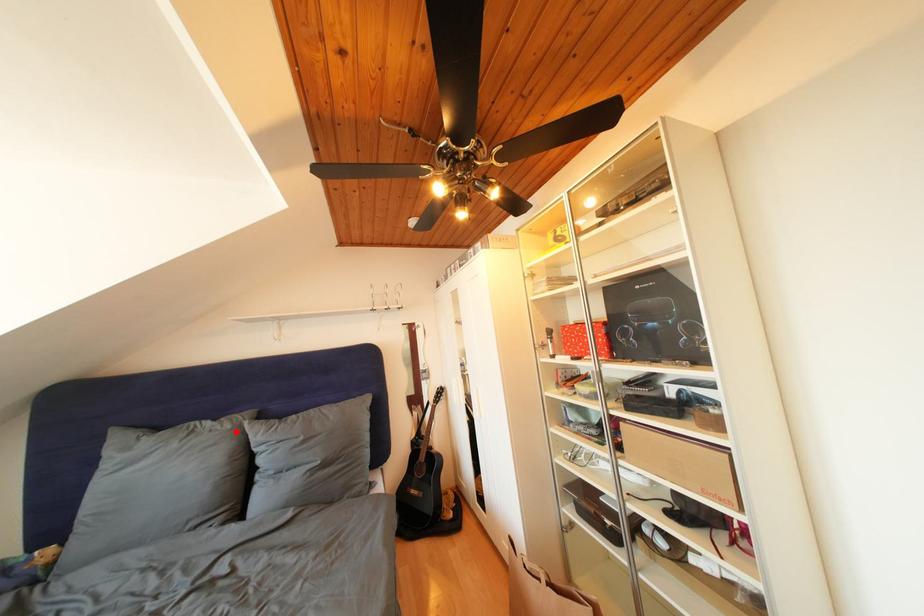
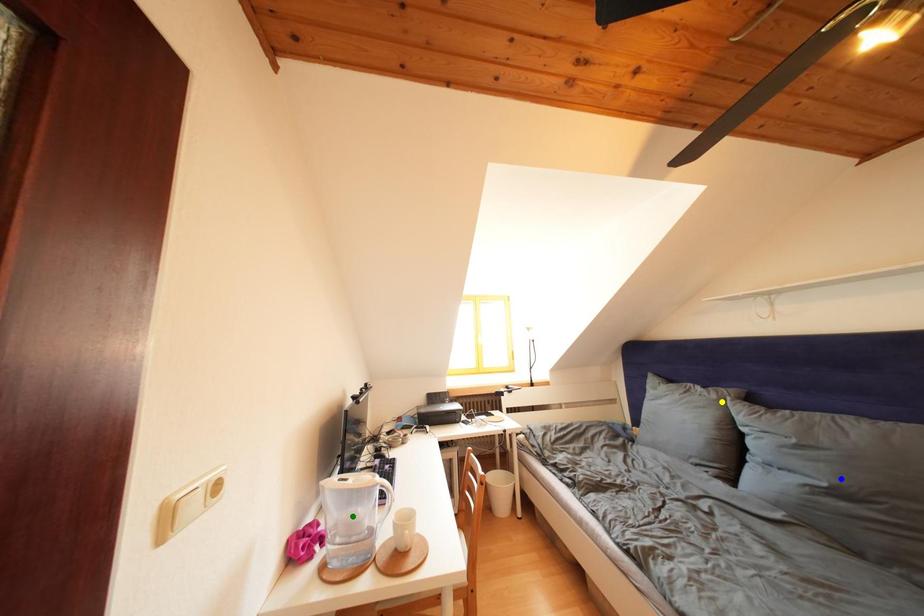
Question: I am providing you with two images of the same scene from different viewpoints. A red point is marked on the first image. You are given multiple points on the second image. Which point in image 2 is actually the same real-world point as the red point in image 1?

Choices:
 (A) blue point
 (B) green point
 (C) yellow point

Answer: (C)